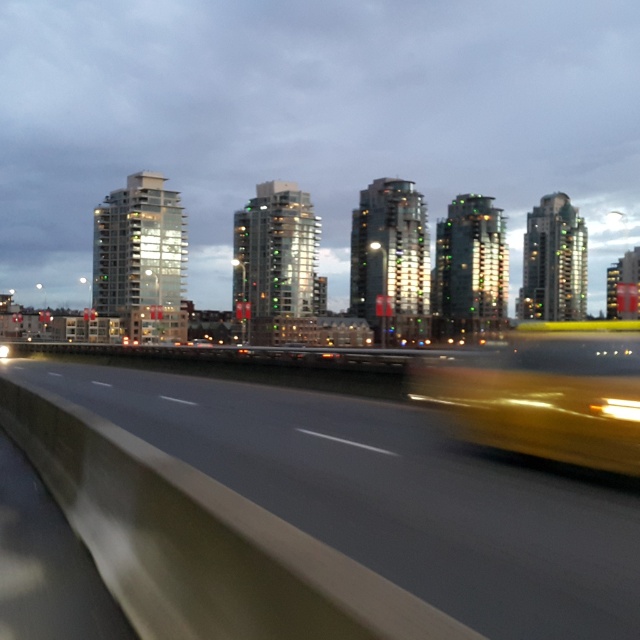
Question: Which object is closer to the camera taking this photo?

Choices:
 (A) smooth asphalt highway at center
 (B) yellow rubber taxi at center

Answer: (A)

Question: Which object appears closest to the camera in this image?

Choices:
 (A) yellow rubber taxi at center
 (B) smooth asphalt highway at center

Answer: (B)

Question: Considering the relative positions of smooth asphalt highway at center and yellow rubber taxi at center in the image provided, where is smooth asphalt highway at center located with respect to yellow rubber taxi at center?

Choices:
 (A) left
 (B) right

Answer: (A)

Question: Is smooth asphalt highway at center thinner than yellow rubber taxi at center?

Choices:
 (A) yes
 (B) no

Answer: (B)

Question: Can you confirm if smooth asphalt highway at center is positioned to the right of yellow rubber taxi at center?

Choices:
 (A) no
 (B) yes

Answer: (A)